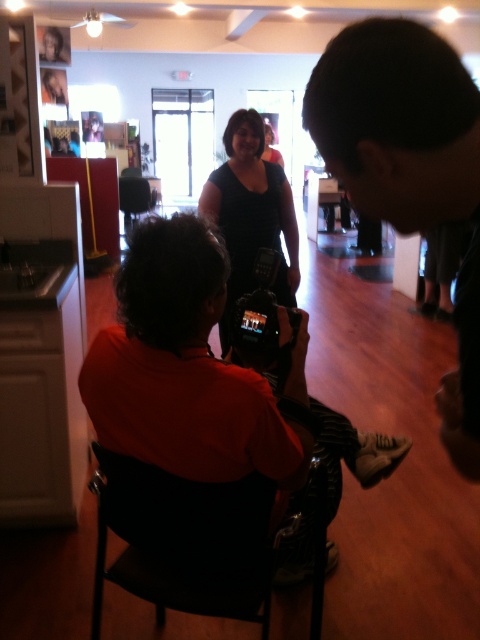
Question: Based on their relative distances, which object is nearer to the matte black dress at center?

Choices:
 (A) black plastic chair at lower center
 (B) black plastic video camera at center

Answer: (B)

Question: Can you confirm if black plastic chair at lower center is thinner than matte black dress at center?

Choices:
 (A) no
 (B) yes

Answer: (A)

Question: Which point is closer to the camera?

Choices:
 (A) (194, 502)
 (B) (248, 336)

Answer: (A)

Question: Which of the following is the closest to the observer?

Choices:
 (A) black plastic chair at lower center
 (B) black plastic video camera at center

Answer: (A)

Question: In this image, where is black plastic chair at lower center located relative to black plastic video camera at center?

Choices:
 (A) above
 (B) below

Answer: (B)

Question: Does matte black dress at center appear on the left side of black plastic video camera at center?

Choices:
 (A) no
 (B) yes

Answer: (B)